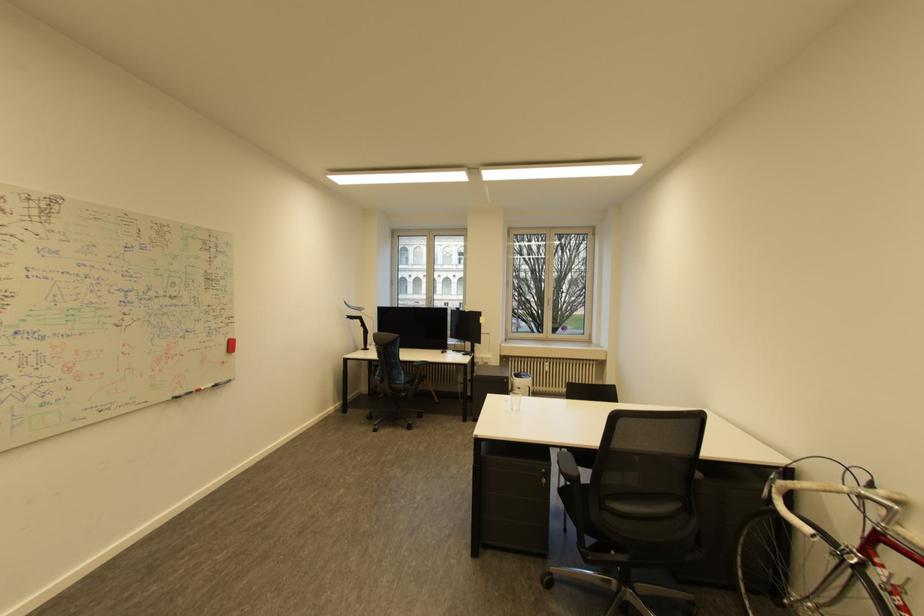
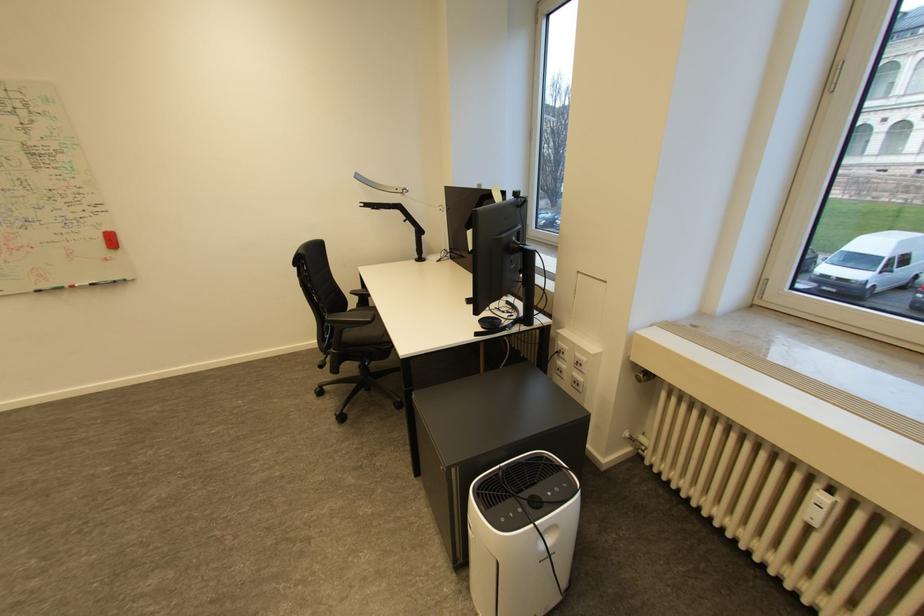
The point at (184,395) is marked in the first image. Where is the corresponding point in the second image?

(47, 288)